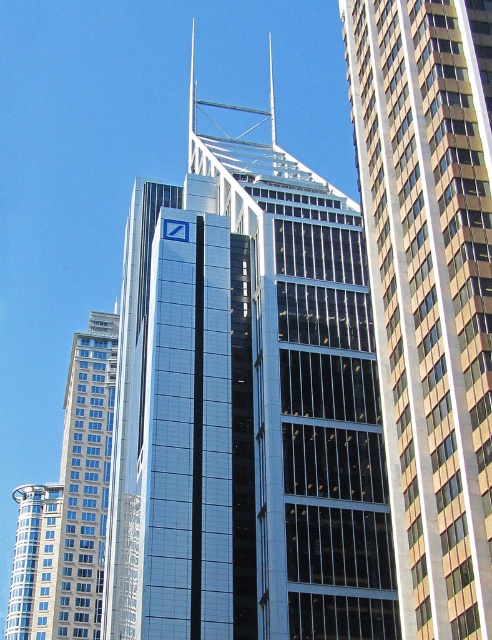
You are standing at point (x=246, y=406) in the urban landscape. What object is located exactly at your current position?

The shiny glass skyscraper at center is located exactly at point (x=246, y=406).